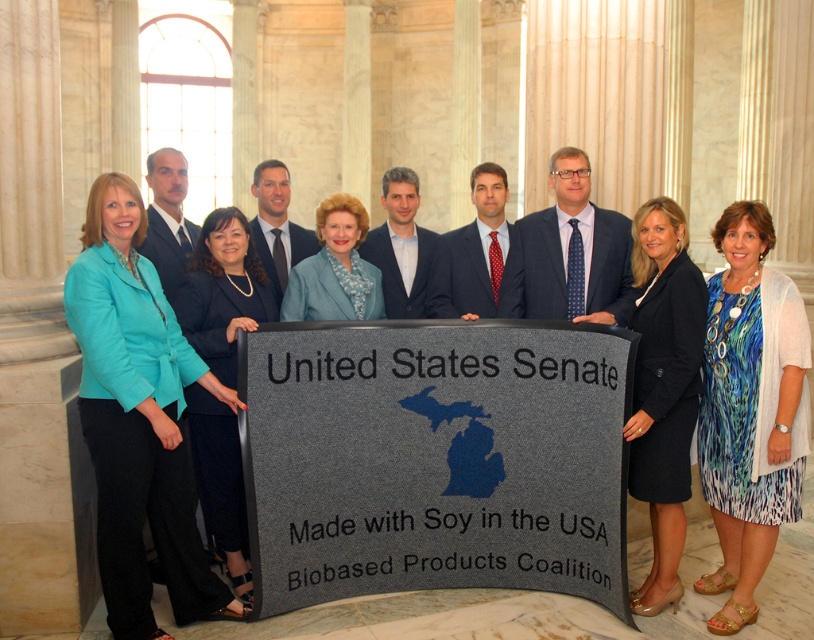
Is blue textured suit at center thinner than blue textured blazer at center?

No.

Does point (591, 244) come farther from viewer compared to point (359, 296)?

Yes, it is behind point (359, 296).

Looking at this image, measure the distance between blue textured suit at center and camera.

13.83 meters

Image resolution: width=814 pixels, height=640 pixels. I want to click on blue textured suit at center, so click(x=572, y=252).

Can you confirm if gray fabric sign at center is shorter than teal fabric jacket at center?

Correct, gray fabric sign at center is not as tall as teal fabric jacket at center.

Can you confirm if gray fabric sign at center is positioned to the left of teal fabric jacket at center?

No, gray fabric sign at center is not to the left of teal fabric jacket at center.

The image size is (814, 640). In order to click on gray fabric sign at center in this screenshot , I will do `click(434, 458)`.

This screenshot has height=640, width=814. Identify the location of gray fabric sign at center. (434, 458).

Looking at this image, does teal fabric jacket at center have a greater width compared to teal fabric jacket at left?

Yes.

Can you confirm if teal fabric jacket at center is positioned below teal fabric jacket at left?

Actually, teal fabric jacket at center is above teal fabric jacket at left.

Describe the element at coordinates (138, 419) in the screenshot. I see `teal fabric jacket at center` at that location.

Locate an element on the screen. The height and width of the screenshot is (640, 814). teal fabric jacket at center is located at coordinates (138, 419).